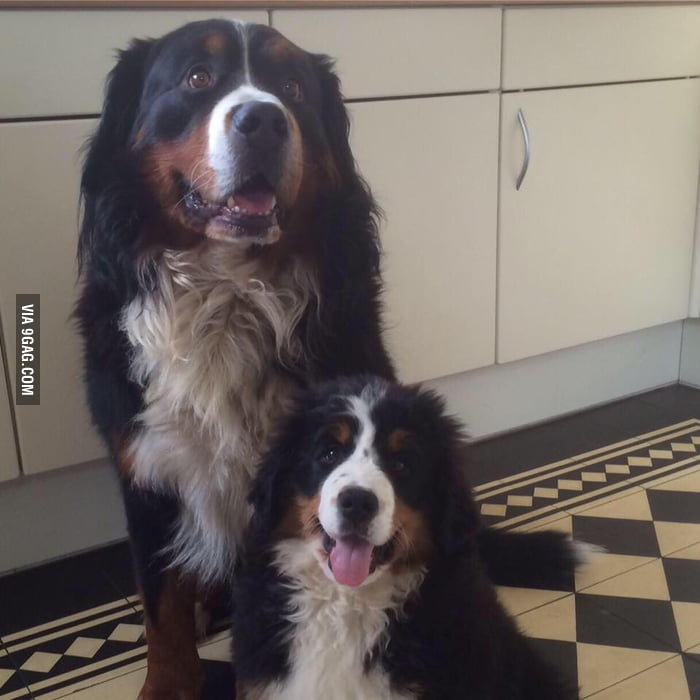
Find the location of a particular element. handle is located at coordinates (526, 150).